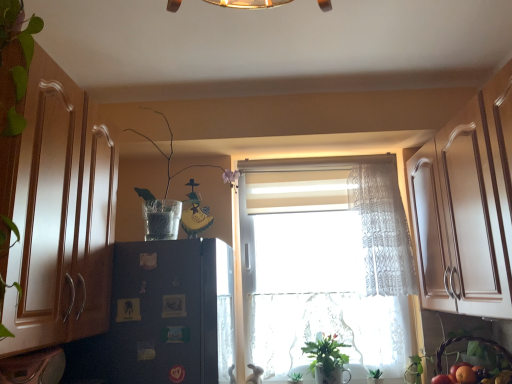
Question: From a real-world perspective, relative to black matte refrigerator at left, is white lace curtain at center vertically above or below?

Choices:
 (A) above
 (B) below

Answer: (A)

Question: Is point (372, 170) closer or farther from the camera than point (190, 279)?

Choices:
 (A) closer
 (B) farther

Answer: (B)

Question: Based on their relative distances, which object is farther from the clear glass vase at upper center, the second plant from the back?

Choices:
 (A) green matte plant at lower center
 (B) black matte refrigerator at left
 (C) green leafy plant at lower center, which appears as the 1th plant when ordered from the bottom
 (D) wooden cabinet at left
 (E) white lace curtain at center

Answer: (C)

Question: Estimate the real-world distances between objects in this image. Which object is farther from the white lace curtain at center?

Choices:
 (A) brown woven basket at lower right
 (B) wooden cabinet at left
 (C) clear glass vase at upper center, the 2th plant from the bottom
 (D) orange matte at lower right
 (E) black matte refrigerator at left

Answer: (B)